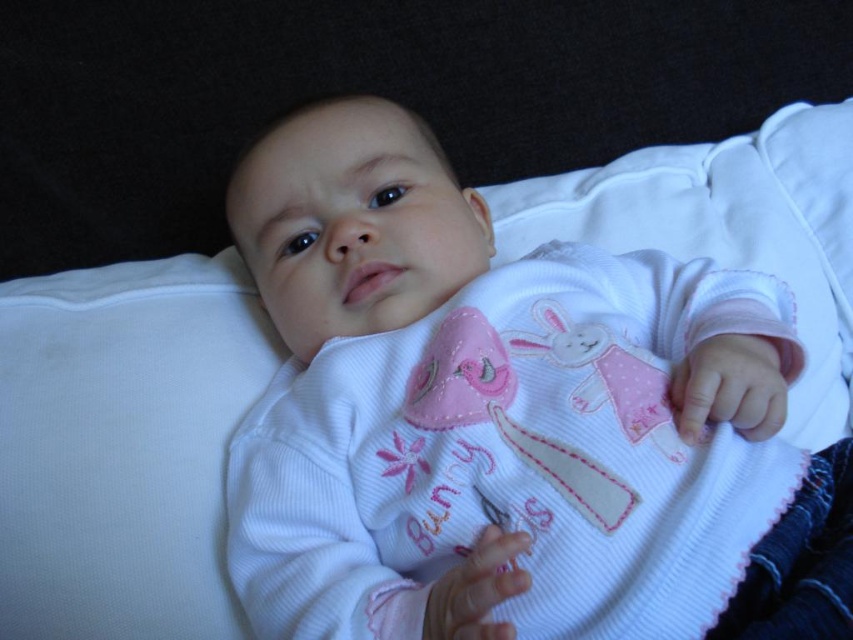
Does white corduroy onesie at center have a lesser height compared to white soft pillow at upper left?

No, white corduroy onesie at center is not shorter than white soft pillow at upper left.

Can you confirm if white corduroy onesie at center is bigger than white soft pillow at upper left?

Yes.

In order to click on white corduroy onesie at center in this screenshot , I will do `click(509, 420)`.